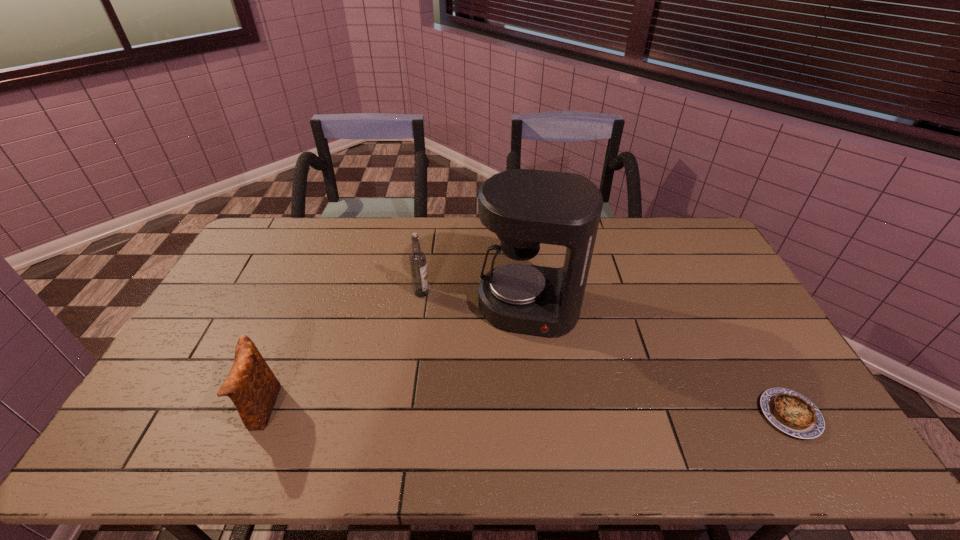
Identify the location of vacant point located between the tallest object and the rightmost object. (660, 361).

Find the location of `vacant area that lies between the vodka and the clutch bag`. vacant area that lies between the vodka and the clutch bag is located at coordinates (342, 351).

Where is `vacant area between the second object from left to right and the third tallest object`? The height and width of the screenshot is (540, 960). vacant area between the second object from left to right and the third tallest object is located at coordinates (342, 351).

Where is `free space between the third object from left to right and the rightmost object`? This screenshot has width=960, height=540. free space between the third object from left to right and the rightmost object is located at coordinates (660, 361).

The width and height of the screenshot is (960, 540). I want to click on vacant region between the vodka and the coffee maker, so point(475,300).

The height and width of the screenshot is (540, 960). Find the location of `vacant space in between the leftmost object and the quiche`. vacant space in between the leftmost object and the quiche is located at coordinates (525, 411).

Identify the location of free space between the coffee maker and the vodka. The height and width of the screenshot is (540, 960). (475, 300).

At what (x,y) coordinates should I click in order to perform the action: click on free point between the coffee maker and the leftmost object. Please return your answer as a coordinate pair (x, y). This screenshot has height=540, width=960. Looking at the image, I should click on click(396, 359).

What are the coordinates of `the closest object to the coffee maker` in the screenshot? It's located at (417, 258).

Locate an element on the screen. The height and width of the screenshot is (540, 960). object identified as the second closest to the third object from left to right is located at coordinates (792, 413).